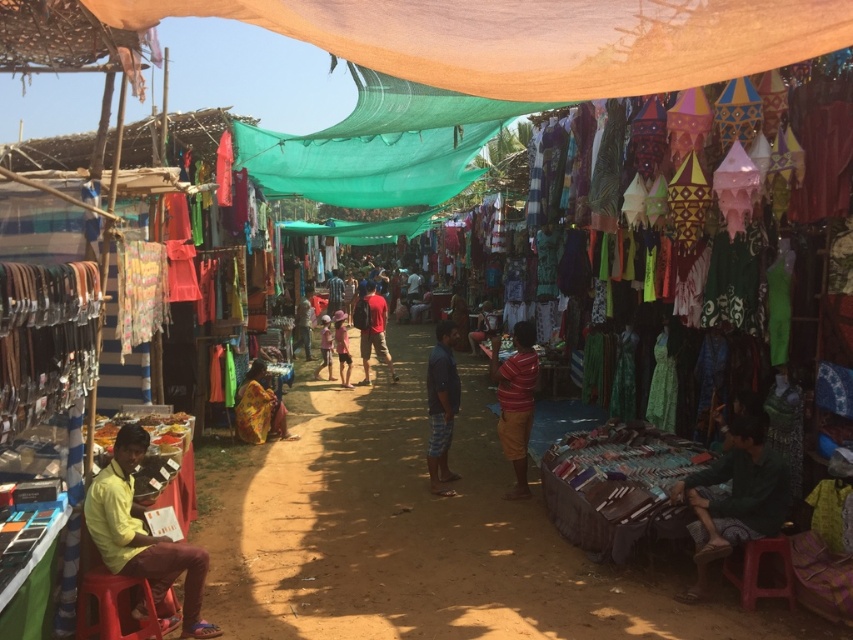
You are a customer at the market and want to compare the heights of the green fabric at lower right and the light pink fabric at center. Which one is taller?

The green fabric at lower right is taller than the light pink fabric at center.

You are a customer at the market looking for a fabric to make a small accessory. You see the green fabric at lower right and the light blue fabric at center. Which fabric would be more suitable for your project?

The green fabric at lower right has a smaller size compared to light blue fabric at center, so it would be more suitable for making a small accessory.